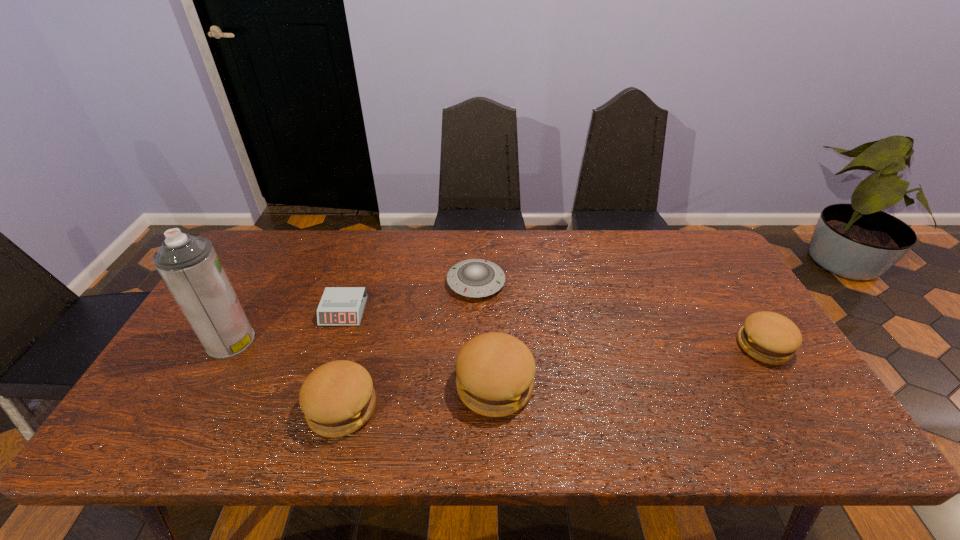
You are a GUI agent. You are given a task and a screenshot of the screen. Output one action in this format:
    pyautogui.click(x=<x>, y=<y>)
    Task: Click on the blank space at the left edge of the desktop
    The height and width of the screenshot is (540, 960).
    Given the screenshot: What is the action you would take?
    pyautogui.click(x=189, y=345)

Locate an element on the screen. This screenshot has height=540, width=960. vacant area at the far left corner of the desktop is located at coordinates (281, 231).

I want to click on vacant space in between the rightmost hamburger and the saucer, so click(x=620, y=315).

Image resolution: width=960 pixels, height=540 pixels. Identify the location of vacant space that is in between the third tallest object and the alarm clock. (343, 360).

Locate an element on the screen. vacant region between the alarm clock and the second hamburger from left to right is located at coordinates (420, 349).

Locate an element on the screen. The height and width of the screenshot is (540, 960). free space between the alarm clock and the second hamburger from right to left is located at coordinates (420, 349).

This screenshot has width=960, height=540. I want to click on vacant point located between the alarm clock and the aerosol can, so click(287, 326).

I want to click on vacant space in between the aerosol can and the second hamburger from right to left, so click(x=363, y=363).

Identify the location of free area in between the tallest object and the alarm clock. The width and height of the screenshot is (960, 540). (287, 326).

Identify which object is the fifth nearest to the saucer. Please provide its 2D coordinates. Your answer should be formatted as a tuple, i.e. [(x, y)], where the tuple contains the x and y coordinates of a point satisfying the conditions above.

[(769, 337)]